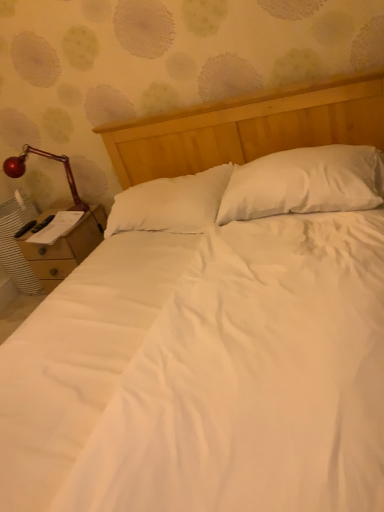
Question: Is wooden nightstand at left not close to white soft pillow at center, the first pillow in the left-to-right sequence?

Choices:
 (A) yes
 (B) no

Answer: (B)

Question: Is wooden nightstand at left surrounding white soft pillow at center, the first pillow in the left-to-right sequence?

Choices:
 (A) yes
 (B) no

Answer: (B)

Question: Is wooden nightstand at left touching white soft pillow at center, the first pillow in the left-to-right sequence?

Choices:
 (A) yes
 (B) no

Answer: (B)

Question: From a real-world perspective, is wooden nightstand at left located beneath white soft pillow at center, the first pillow in the left-to-right sequence?

Choices:
 (A) no
 (B) yes

Answer: (B)

Question: Is wooden nightstand at left oriented towards white soft pillow at center, the first pillow in the left-to-right sequence?

Choices:
 (A) no
 (B) yes

Answer: (A)

Question: From a real-world perspective, is shiny red lamp at left physically located above or below white soft pillow at center, the first pillow in the right-to-left sequence?

Choices:
 (A) above
 (B) below

Answer: (A)

Question: Based on their positions, is shiny red lamp at left located to the left or right of white soft pillow at center, the first pillow in the right-to-left sequence?

Choices:
 (A) right
 (B) left

Answer: (B)

Question: Considering the positions of shiny red lamp at left and white soft pillow at center, the first pillow in the right-to-left sequence, in the image, is shiny red lamp at left wider or thinner than white soft pillow at center, the first pillow in the right-to-left sequence,?

Choices:
 (A) thin
 (B) wide

Answer: (A)

Question: Is shiny red lamp at left inside the boundaries of white soft pillow at center, which is counted as the 2th pillow, starting from the left, or outside?

Choices:
 (A) inside
 (B) outside

Answer: (B)

Question: Considering their positions, is wooden nightstand at left located in front of or behind shiny red lamp at left?

Choices:
 (A) behind
 (B) front

Answer: (A)

Question: From a real-world perspective, is wooden nightstand at left physically located above or below shiny red lamp at left?

Choices:
 (A) below
 (B) above

Answer: (A)

Question: From the image's perspective, relative to shiny red lamp at left, is wooden nightstand at left above or below?

Choices:
 (A) below
 (B) above

Answer: (A)

Question: Would you say wooden nightstand at left is to the left or to the right of shiny red lamp at left in the picture?

Choices:
 (A) right
 (B) left

Answer: (A)

Question: From a real-world perspective, is white soft pillow at center, the first pillow in the right-to-left sequence, positioned above or below shiny red lamp at left?

Choices:
 (A) above
 (B) below

Answer: (B)

Question: Would you say white soft pillow at center, the first pillow in the right-to-left sequence, is to the left or to the right of shiny red lamp at left in the picture?

Choices:
 (A) right
 (B) left

Answer: (A)